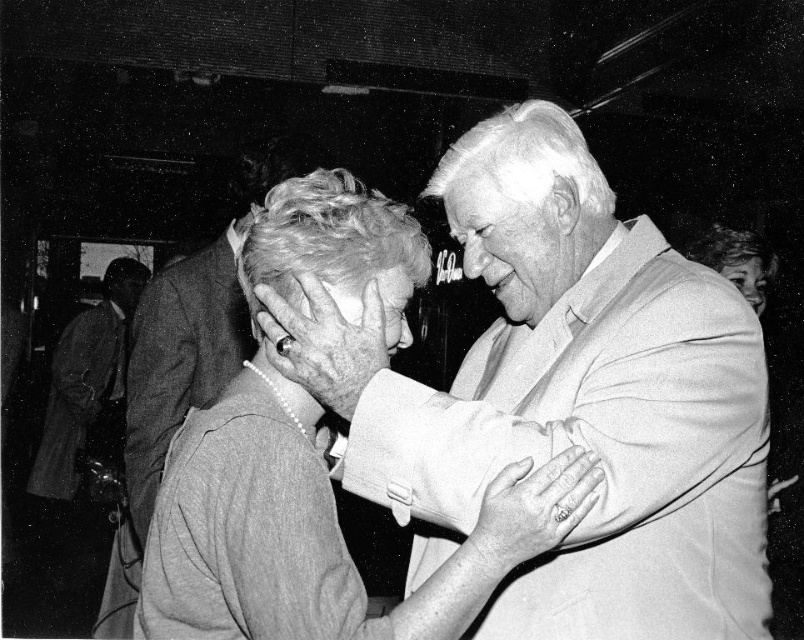
Based on the scene description, where exactly is the smooth skin face at center located in the image?

The smooth skin face at center is located at point coordinates of 0.380 in the x axis and 0.641 in the y axis.

Based on the scene described, which object, the smooth skin face at center or the smooth gray hair at center, appears smaller in the photograph?

The smooth skin face at center has a smaller size compared to the smooth gray hair at center.

You are a photographer at the event. You want to take a photo of the smooth gray hair at center without the smooth beige suit at upper right blocking it. Is this possible?

The smooth beige suit at upper right is in front of the smooth gray hair at center, so it would block the view. Move to a position where the smooth beige suit at upper right is not between you and the smooth gray hair at center to capture the desired shot.